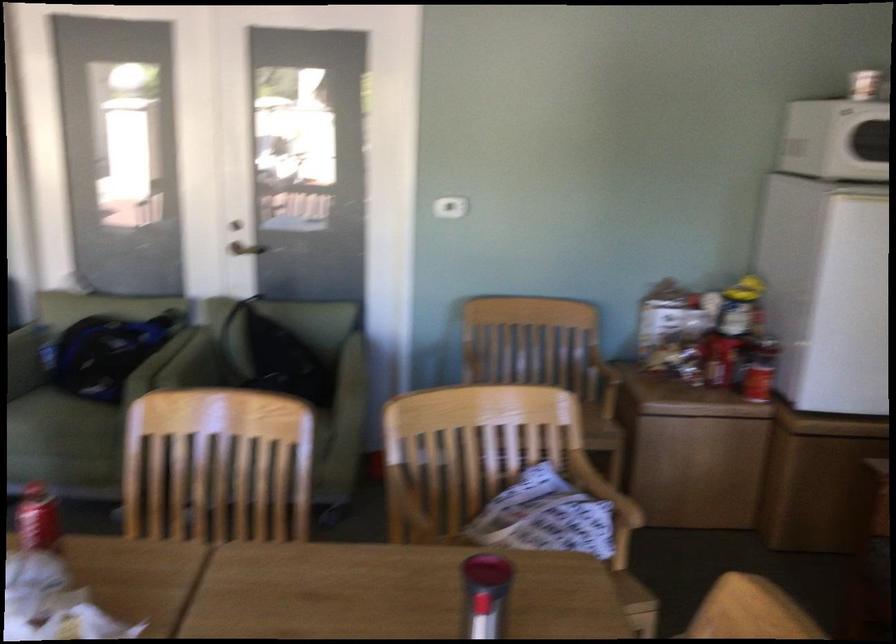
Where would you lift the black backpack? Please return your answer as a coordinate pair (x, y).

(282, 359)